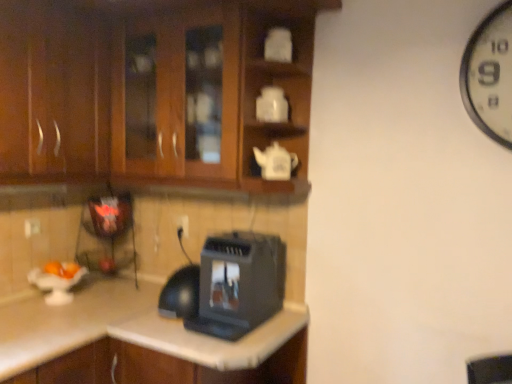
You are a GUI agent. You are given a task and a screenshot of the screen. Output one action in this format:
    pyautogui.click(x=<x>, y=<y>)
    Task: Click on the black plastic toaster at lower center
    Image resolution: width=512 pixels, height=384 pixels.
    Given the screenshot: What is the action you would take?
    pyautogui.click(x=239, y=284)

Locate an element on the screen. Image resolution: width=512 pixels, height=384 pixels. metallic black toaster at lower left is located at coordinates (106, 233).

Identify the location of white plastic electric outlet at center. The width and height of the screenshot is (512, 384). (183, 224).

Is brown wood cabinets at upper left, positioned as the 2th cabinetry in left-to-right order, at the back of white plastic electric outlet at center?

No, white plastic electric outlet at center is not facing the opposite direction of brown wood cabinets at upper left, positioned as the 2th cabinetry in left-to-right order.

Is point (187, 231) closer or farther from the camera than point (250, 77)?

Clearly, point (187, 231) is more distant from the camera than point (250, 77).

Does white plastic electric outlet at center have a lesser width compared to brown wood cabinets at upper left, the first cabinetry in the right-to-left sequence?

Yes.

In the scene shown: Is white plastic electric outlet at center to the left or to the right of brown wood cabinets at upper left, positioned as the 2th cabinetry in left-to-right order, in the image?

white plastic electric outlet at center is to the right of brown wood cabinets at upper left, positioned as the 2th cabinetry in left-to-right order.

Does metallic black toaster at lower left have a larger size compared to brown wood cabinets at upper left, the first cabinetry in the right-to-left sequence?

Actually, metallic black toaster at lower left might be smaller than brown wood cabinets at upper left, the first cabinetry in the right-to-left sequence.

Measure the distance from metallic black toaster at lower left to brown wood cabinets at upper left, positioned as the 2th cabinetry in left-to-right order.

26.15 inches.

Based on the photo, can you tell me how much metallic black toaster at lower left and brown wood cabinets at upper left, positioned as the 2th cabinetry in left-to-right order, differ in facing direction?

The angle between the facing direction of metallic black toaster at lower left and the facing direction of brown wood cabinets at upper left, positioned as the 2th cabinetry in left-to-right order, is 87 degrees.

Does metallic black toaster at lower left come behind brown wood cabinets at upper left, positioned as the 2th cabinetry in left-to-right order?

Yes.

From the image's perspective, who appears lower, dark wood cabinet at left, the 1th cabinetry positioned from the left, or brown wood cabinets at upper left, positioned as the 2th cabinetry in left-to-right order?

dark wood cabinet at left, the 1th cabinetry positioned from the left, from the image's perspective.

From a real-world perspective, is dark wood cabinet at left, which appears as the second cabinetry when viewed from the right, above or below brown wood cabinets at upper left, positioned as the 2th cabinetry in left-to-right order?

dark wood cabinet at left, which appears as the second cabinetry when viewed from the right, is situated lower than brown wood cabinets at upper left, positioned as the 2th cabinetry in left-to-right order, in the real world.

Is dark wood cabinet at left, the 1th cabinetry positioned from the left, taller or shorter than brown wood cabinets at upper left, the first cabinetry in the right-to-left sequence?

In the image, dark wood cabinet at left, the 1th cabinetry positioned from the left, appears to be shorter than brown wood cabinets at upper left, the first cabinetry in the right-to-left sequence.

Which of these two, black plastic toaster at lower center or brown wood cabinets at upper left, the first cabinetry in the right-to-left sequence, is thinner?

With smaller width is black plastic toaster at lower center.

Could you tell me if black plastic toaster at lower center is facing brown wood cabinets at upper left, the first cabinetry in the right-to-left sequence?

No, black plastic toaster at lower center is not turned towards brown wood cabinets at upper left, the first cabinetry in the right-to-left sequence.

Between black plastic toaster at lower center and brown wood cabinets at upper left, the first cabinetry in the right-to-left sequence, which one has larger size?

brown wood cabinets at upper left, the first cabinetry in the right-to-left sequence.

Is black plastic toaster at lower center outside of brown wood cabinets at upper left, positioned as the 2th cabinetry in left-to-right order?

Yes, black plastic toaster at lower center is outside of brown wood cabinets at upper left, positioned as the 2th cabinetry in left-to-right order.

Is metallic black toaster at lower left in front of or behind beige laminate countertop at lower center in the image?

In the image, metallic black toaster at lower left appears behind beige laminate countertop at lower center.

Is point (98, 201) farther from camera compared to point (298, 309)?

Yes.

Which of these two, metallic black toaster at lower left or beige laminate countertop at lower center, is bigger?

beige laminate countertop at lower center.

From the image's perspective, is metallic black toaster at lower left located above beige laminate countertop at lower center?

Yes, from the image's perspective, metallic black toaster at lower left is on top of beige laminate countertop at lower center.

Is point (183, 5) positioned in front of point (221, 295)?

Yes.

From their relative heights in the image, would you say brown wood cabinets at upper left, positioned as the 2th cabinetry in left-to-right order, is taller or shorter than black plastic toaster at lower center?

brown wood cabinets at upper left, positioned as the 2th cabinetry in left-to-right order, is taller than black plastic toaster at lower center.

The height and width of the screenshot is (384, 512). I want to click on the 1st cabinetry to the left when counting from the black plastic toaster at lower center, so click(x=155, y=87).

Is the depth of brown wood cabinets at upper left, the first cabinetry in the right-to-left sequence, greater than that of black plastic toaster at lower center?

No, the depth of brown wood cabinets at upper left, the first cabinetry in the right-to-left sequence, is less than that of black plastic toaster at lower center.

Which is farther from the camera, (214, 295) or (45, 66)?

The point (214, 295) is farther.

In order to click on home appliance to the right of dark wood cabinet at left, which appears as the second cabinetry when viewed from the right in this screenshot , I will do `click(239, 284)`.

Locate an element on the screen. electric outlet below the brown wood cabinets at upper left, the first cabinetry in the right-to-left sequence (from the image's perspective) is located at coordinates (183, 224).

I want to click on cabinetry that is on the right side of metallic black toaster at lower left, so click(x=155, y=87).

Looking at this image, from the image, which object appears to be nearer to brown wood cabinets at upper left, positioned as the 2th cabinetry in left-to-right order, metallic black toaster at lower left or black plastic toaster at lower center?

The object closer to brown wood cabinets at upper left, positioned as the 2th cabinetry in left-to-right order, is black plastic toaster at lower center.

Looking at the image, which one is located closer to white plastic electric outlet at center, beige laminate countertop at lower center or black plastic toaster at lower center?

black plastic toaster at lower center is closer to white plastic electric outlet at center.

Considering their positions, is beige laminate countertop at lower center positioned further to dark wood cabinet at left, which appears as the second cabinetry when viewed from the right, than black plastic toaster at lower center?

Based on the image, beige laminate countertop at lower center appears to be further to dark wood cabinet at left, which appears as the second cabinetry when viewed from the right.

Considering their positions, is metallic black toaster at lower left positioned further to white plastic electric outlet at center than beige laminate countertop at lower center?

beige laminate countertop at lower center is further to white plastic electric outlet at center.

From the image, which object appears to be farther from black plastic toaster at lower center, dark wood cabinet at left, which appears as the second cabinetry when viewed from the right, or beige laminate countertop at lower center?

Based on the image, dark wood cabinet at left, which appears as the second cabinetry when viewed from the right, appears to be further to black plastic toaster at lower center.

Estimate the real-world distances between objects in this image. Which object is further from dark wood cabinet at left, which appears as the second cabinetry when viewed from the right, brown wood cabinets at upper left, positioned as the 2th cabinetry in left-to-right order, or beige laminate countertop at lower center?

Based on the image, beige laminate countertop at lower center appears to be further to dark wood cabinet at left, which appears as the second cabinetry when viewed from the right.

From the image, which object appears to be nearer to beige laminate countertop at lower center, brown wood cabinets at upper left, the first cabinetry in the right-to-left sequence, or white plastic electric outlet at center?

white plastic electric outlet at center.

Considering their positions, is black plastic toaster at lower center positioned further to metallic black toaster at lower left than dark wood cabinet at left, the 1th cabinetry positioned from the left?

Among the two, black plastic toaster at lower center is located further to metallic black toaster at lower left.

Where is `home appliance located between brown wood cabinets at upper left, positioned as the 2th cabinetry in left-to-right order, and metallic black toaster at lower left in the depth direction`? home appliance located between brown wood cabinets at upper left, positioned as the 2th cabinetry in left-to-right order, and metallic black toaster at lower left in the depth direction is located at coordinates (239, 284).

The width and height of the screenshot is (512, 384). In order to click on appliance between dark wood cabinet at left, the 1th cabinetry positioned from the left, and beige laminate countertop at lower center vertically in this screenshot , I will do `click(106, 233)`.

Find the location of a particular element. electric outlet between dark wood cabinet at left, which appears as the second cabinetry when viewed from the right, and metallic black toaster at lower left vertically is located at coordinates (183, 224).

Locate an element on the screen. The image size is (512, 384). cabinetry between brown wood cabinets at upper left, positioned as the 2th cabinetry in left-to-right order, and black plastic toaster at lower center from top to bottom is located at coordinates (53, 92).